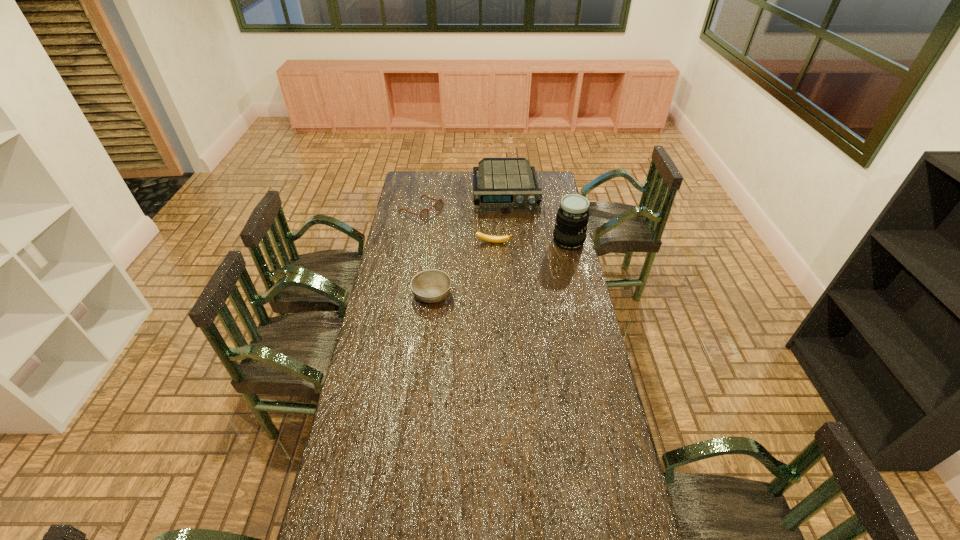
Locate an element on the screen. vacant space on the desktop that is between the bowl and the rightmost object and is positioned on the front panel of the fourth shortest object is located at coordinates (513, 263).

This screenshot has height=540, width=960. In order to click on free space on the desktop that is between the bowl and the telephoto lens and is positioned on the front-facing side of the spectacles in this screenshot , I will do `click(521, 260)`.

This screenshot has width=960, height=540. I want to click on vacant spot on the desktop that is between the bowl and the rightmost object and is positioned at the stem of the banana, so click(x=492, y=271).